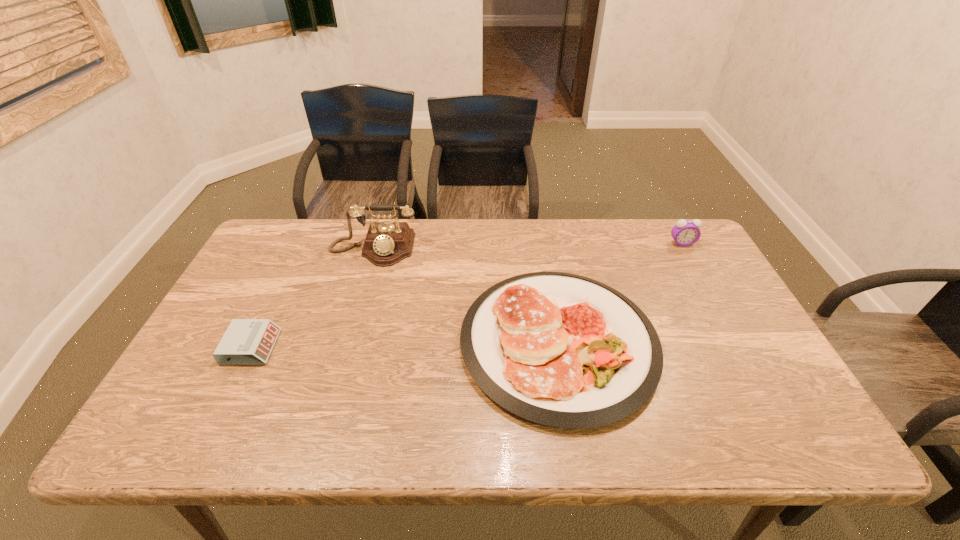
The height and width of the screenshot is (540, 960). I want to click on free space at the left edge of the desktop, so click(x=190, y=398).

I want to click on free region at the right edge of the desktop, so [697, 341].

The width and height of the screenshot is (960, 540). I want to click on vacant area at the near right corner, so click(x=756, y=423).

The image size is (960, 540). I want to click on blank region between the nearer alarm clock and the second tallest object, so click(x=467, y=295).

You are a GUI agent. You are given a task and a screenshot of the screen. Output one action in this format:
    pyautogui.click(x=<x>, y=<y>)
    Task: Click on the vacant area that lies between the third shortest object and the third object from left to right
    The height and width of the screenshot is (540, 960).
    Given the screenshot: What is the action you would take?
    pyautogui.click(x=620, y=293)

Find the location of a particular element. This screenshot has width=960, height=540. free point between the second tallest object and the tallest object is located at coordinates (528, 246).

The width and height of the screenshot is (960, 540). In order to click on empty space that is in between the second shortest object and the nearer alarm clock in this screenshot , I will do `click(405, 345)`.

I want to click on free space between the farther alarm clock and the dish, so click(620, 293).

Locate an element on the screen. This screenshot has height=540, width=960. vacant area between the nearer alarm clock and the farther alarm clock is located at coordinates (467, 295).

The width and height of the screenshot is (960, 540). Identify the location of free space between the third object from right to left and the nearer alarm clock. (312, 298).